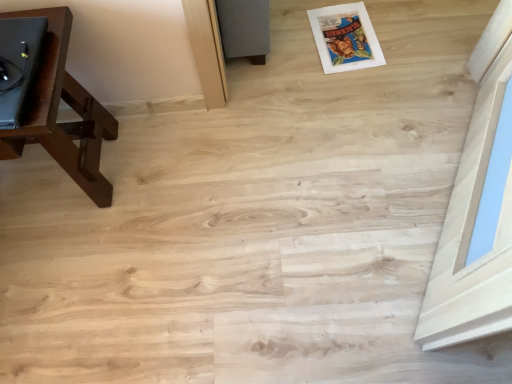
Measure the distance between point (87, 146) and camera.

3.77 feet.

The width and height of the screenshot is (512, 384). What do you see at coordinates (57, 112) in the screenshot?
I see `brown wood tv stand at left` at bounding box center [57, 112].

Identify the location of brown wood tv stand at left. The height and width of the screenshot is (384, 512). (57, 112).

Locate an element on the screen. Image resolution: width=512 pixels, height=384 pixels. brown wood tv stand at left is located at coordinates (57, 112).